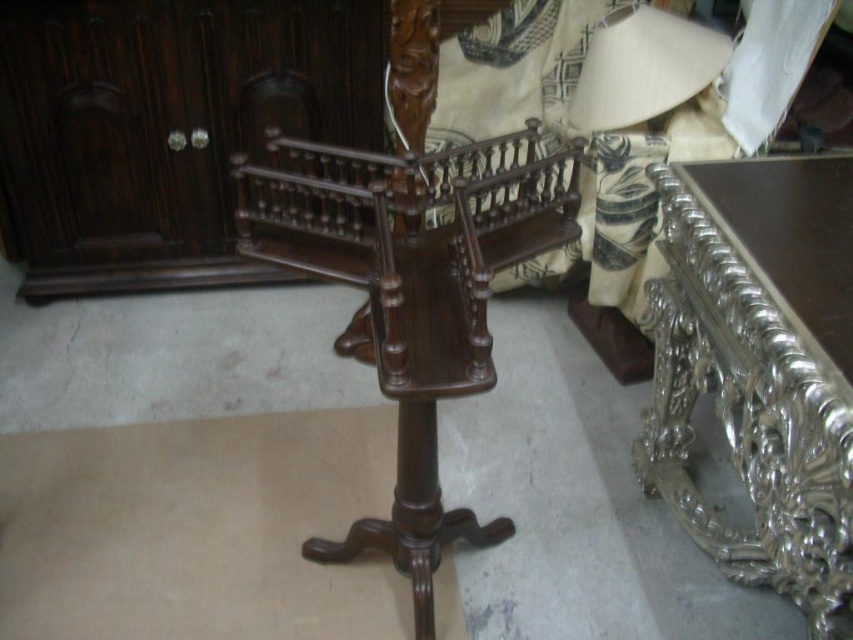
Question: Is the position of silver metallic table at right more distant than that of matte beige paper lampshade at upper right?

Choices:
 (A) no
 (B) yes

Answer: (A)

Question: Which object appears closest to the camera in this image?

Choices:
 (A) matte beige paper lampshade at upper right
 (B) silver metallic table at right
 (C) polished dark wood coat rack at center

Answer: (B)

Question: Which point is closer to the camera taking this photo?

Choices:
 (A) (396, 180)
 (B) (708, 76)
 (C) (695, 330)

Answer: (C)

Question: Among these objects, which one is nearest to the camera?

Choices:
 (A) polished dark wood coat rack at center
 (B) silver metallic table at right

Answer: (B)

Question: Is silver metallic table at right in front of polished dark wood coat rack at center?

Choices:
 (A) no
 (B) yes

Answer: (B)

Question: Does polished dark wood coat rack at center come in front of matte beige paper lampshade at upper right?

Choices:
 (A) no
 (B) yes

Answer: (B)